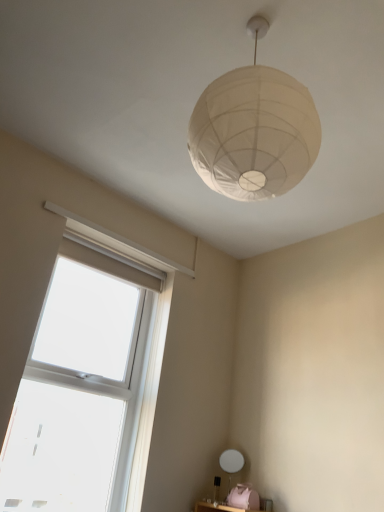
Question: Is clear glass window at lower left surrounded by white paper lampshade at upper center?

Choices:
 (A) no
 (B) yes

Answer: (A)

Question: Can you confirm if white paper lampshade at upper center is wider than clear glass window at lower left?

Choices:
 (A) no
 (B) yes

Answer: (B)

Question: Is white paper lampshade at upper center to the right of clear glass window at lower left from the viewer's perspective?

Choices:
 (A) yes
 (B) no

Answer: (A)

Question: From the image's perspective, is white paper lampshade at upper center located beneath clear glass window at lower left?

Choices:
 (A) yes
 (B) no

Answer: (B)

Question: Considering the relative positions of white paper lampshade at upper center and clear glass window at lower left in the image provided, is white paper lampshade at upper center to the left of clear glass window at lower left from the viewer's perspective?

Choices:
 (A) no
 (B) yes

Answer: (A)

Question: Is white paper lampshade at upper center oriented towards clear glass window at lower left?

Choices:
 (A) no
 (B) yes

Answer: (A)

Question: Is clear glass window at lower left facing towards white paper lampshade at upper center?

Choices:
 (A) no
 (B) yes

Answer: (B)

Question: Is clear glass window at lower left next to white paper lampshade at upper center and touching it?

Choices:
 (A) yes
 (B) no

Answer: (B)

Question: Is clear glass window at lower left outside white paper lampshade at upper center?

Choices:
 (A) no
 (B) yes

Answer: (B)

Question: From the image's perspective, is clear glass window at lower left beneath white paper lampshade at upper center?

Choices:
 (A) no
 (B) yes

Answer: (B)

Question: From a real-world perspective, is clear glass window at lower left beneath white paper lampshade at upper center?

Choices:
 (A) no
 (B) yes

Answer: (B)

Question: Considering the relative sizes of clear glass window at lower left and white paper lampshade at upper center in the image provided, is clear glass window at lower left thinner than white paper lampshade at upper center?

Choices:
 (A) no
 (B) yes

Answer: (B)

Question: From a real-world perspective, is white matte table lamp at lower center physically above white paper lampshade at upper center?

Choices:
 (A) yes
 (B) no

Answer: (B)